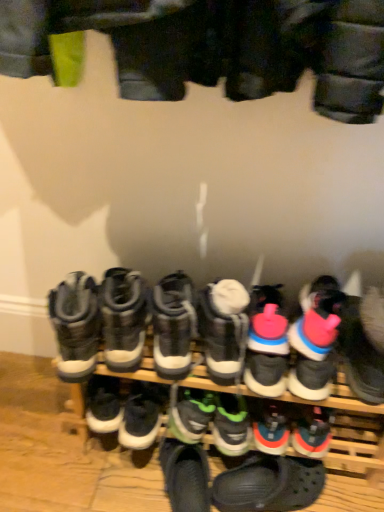
Question: Can you confirm if green rubber sneaker at center, which is the eighth footwear in left-to-right order, is positioned to the right of pink rubber sneaker at right, which appears as the 1th footwear when viewed from the right?

Choices:
 (A) yes
 (B) no

Answer: (B)

Question: Is green rubber sneaker at center, which appears as the fifth footwear when viewed from the right, taller than pink rubber sneaker at right, which appears as the 1th footwear when viewed from the right?

Choices:
 (A) no
 (B) yes

Answer: (A)

Question: Is pink rubber sneaker at right, the 12th footwear in the left-to-right sequence, a part of green rubber sneaker at center, which is the eighth footwear in left-to-right order?

Choices:
 (A) no
 (B) yes

Answer: (A)

Question: From the image's perspective, does green rubber sneaker at center, which is the eighth footwear in left-to-right order, appear higher than pink rubber sneaker at right, the 12th footwear in the left-to-right sequence?

Choices:
 (A) no
 (B) yes

Answer: (A)

Question: From a real-world perspective, is green rubber sneaker at center, which appears as the fifth footwear when viewed from the right, on top of pink rubber sneaker at right, the 12th footwear in the left-to-right sequence?

Choices:
 (A) no
 (B) yes

Answer: (A)

Question: From a real-world perspective, is green rubber sneaker at center, which appears as the fifth footwear when viewed from the right, located beneath pink rubber sneaker at right, which appears as the 1th footwear when viewed from the right?

Choices:
 (A) yes
 (B) no

Answer: (A)

Question: Is white rubber boots at center, the second footwear viewed from the left, thinner than pink rubber sneaker at right, the 12th footwear in the left-to-right sequence?

Choices:
 (A) no
 (B) yes

Answer: (B)

Question: From the image's perspective, is white rubber boots at center, which ranks as the eleventh footwear in right-to-left order, above pink rubber sneaker at right, which appears as the 1th footwear when viewed from the right?

Choices:
 (A) no
 (B) yes

Answer: (B)

Question: Does white rubber boots at center, which ranks as the eleventh footwear in right-to-left order, have a greater height compared to pink rubber sneaker at right, which appears as the 1th footwear when viewed from the right?

Choices:
 (A) yes
 (B) no

Answer: (B)

Question: Is pink rubber sneaker at right, which appears as the 1th footwear when viewed from the right, surrounded by white rubber boots at center, which ranks as the eleventh footwear in right-to-left order?

Choices:
 (A) yes
 (B) no

Answer: (B)

Question: Can you confirm if white rubber boots at center, which ranks as the eleventh footwear in right-to-left order, is smaller than pink rubber sneaker at right, the 12th footwear in the left-to-right sequence?

Choices:
 (A) yes
 (B) no

Answer: (A)

Question: From a real-world perspective, is white rubber boots at center, which ranks as the eleventh footwear in right-to-left order, under pink rubber sneaker at right, the 12th footwear in the left-to-right sequence?

Choices:
 (A) yes
 (B) no

Answer: (A)

Question: Can you confirm if pink rubber sneaker at right, which appears as the 1th footwear when viewed from the right, is positioned to the left of green rubber sneaker at center, which appears as the fifth footwear when viewed from the right?

Choices:
 (A) no
 (B) yes

Answer: (A)